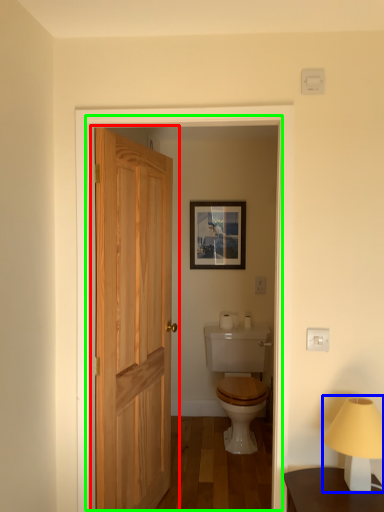
Question: Considering the real-world distances, which object is closest to door (highlighted by a red box)? table lamp (highlighted by a blue box) or screen door (highlighted by a green box).

Choices:
 (A) table lamp
 (B) screen door

Answer: (B)